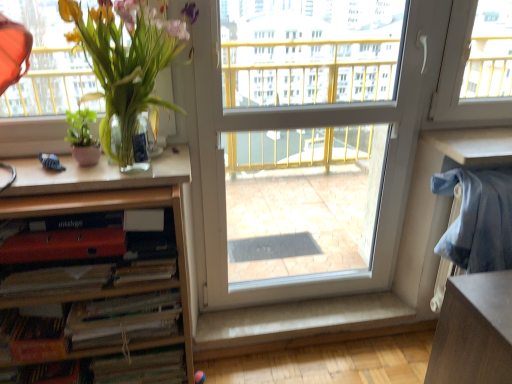
This screenshot has height=384, width=512. Find the location of `free space above white fabric at lower center (from a real-world perspective)`. free space above white fabric at lower center (from a real-world perspective) is located at coordinates (312, 310).